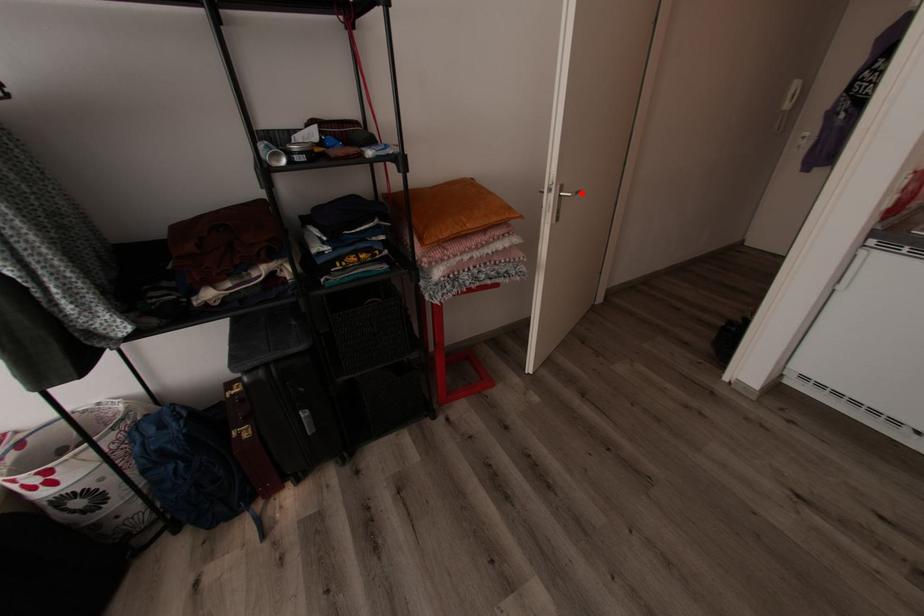
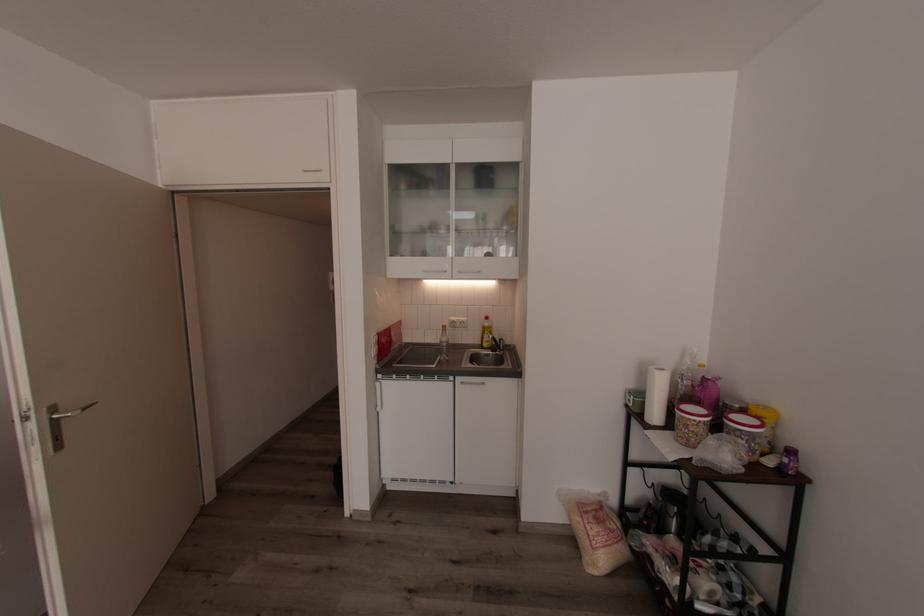
Find the pixel in the second image that matches the highlighted location in the first image.

(90, 408)